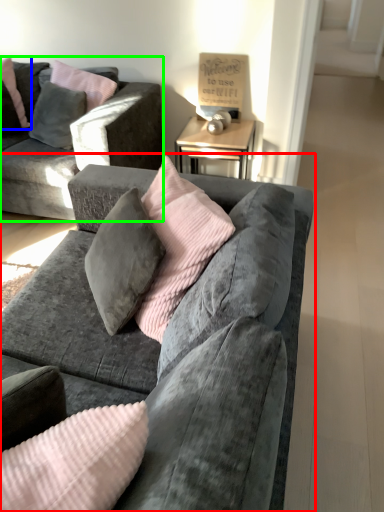
Question: Which object is positioned closest to studio couch (highlighted by a red box)? Select from pillow (highlighted by a blue box) and studio couch (highlighted by a green box).

Choices:
 (A) pillow
 (B) studio couch

Answer: (B)